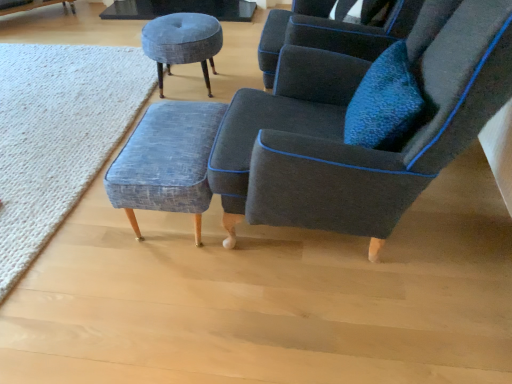
The height and width of the screenshot is (384, 512). I want to click on vacant space in front of textured blue fabric stool at center, which is the 1th stool in bottom-to-top order, so click(172, 295).